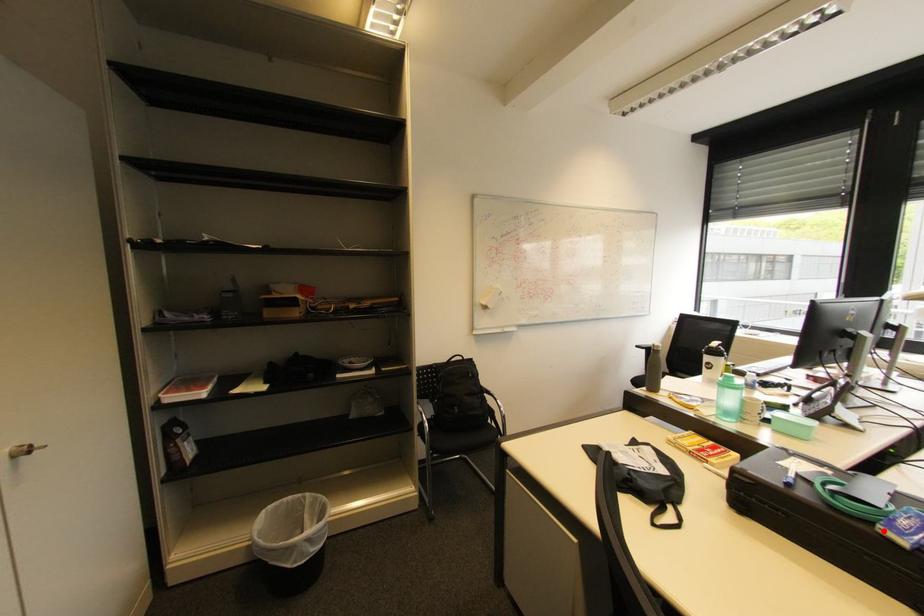
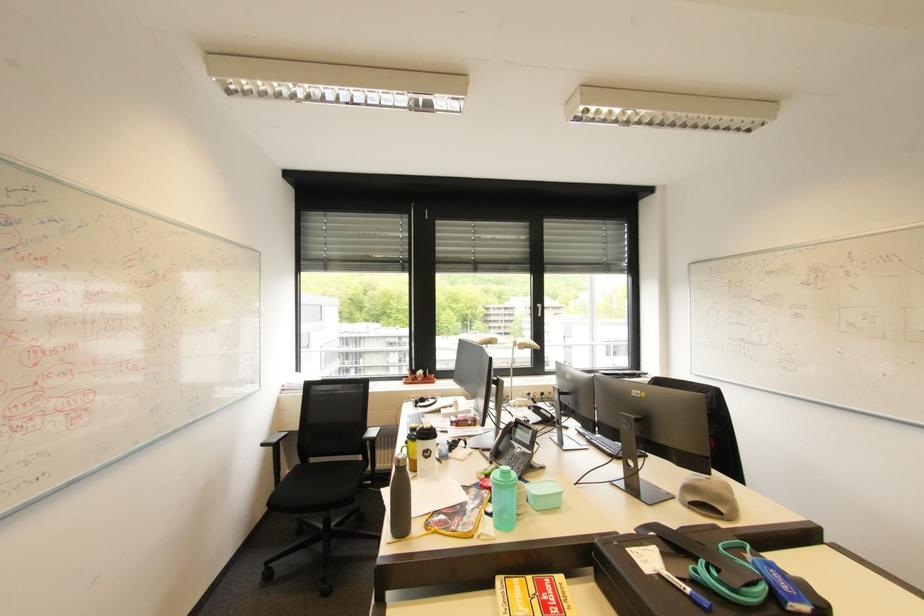
Question: I am providing you with two images of the same scene from different viewpoints. Image1 has a red point marked. In image2, the corresponding 3D location appears at what relative position? Reply with the corresponding letter.

Choices:
 (A) Closer
 (B) Farther

Answer: (B)